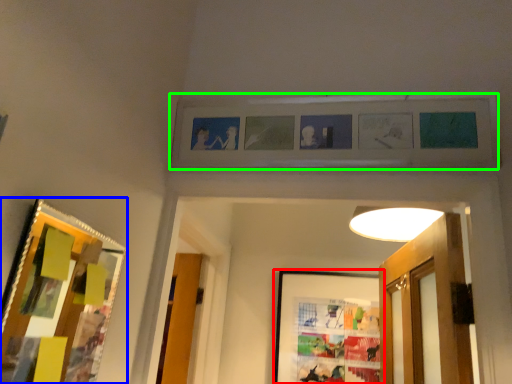
Question: Estimate the real-world distances between objects in this image. Which object is farther from picture frame (highlighted by a red box), picture frame (highlighted by a blue box) or picture frame (highlighted by a green box)?

Choices:
 (A) picture frame
 (B) picture frame

Answer: (A)